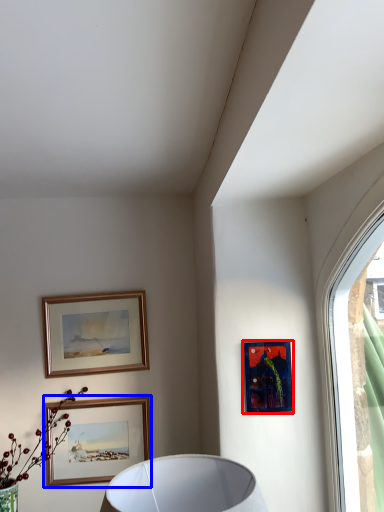
Question: Which object is closer to the camera taking this photo, picture frame (highlighted by a red box) or picture frame (highlighted by a blue box)?

Choices:
 (A) picture frame
 (B) picture frame

Answer: (A)